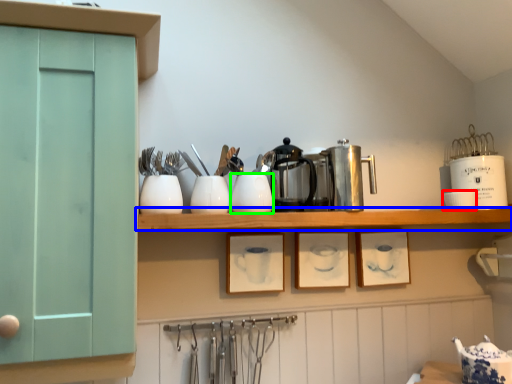
Question: Estimate the real-world distances between objects in this image. Which object is closer to tableware (highlighted by a red box), shelf (highlighted by a blue box) or tableware (highlighted by a green box)?

Choices:
 (A) shelf
 (B) tableware

Answer: (A)